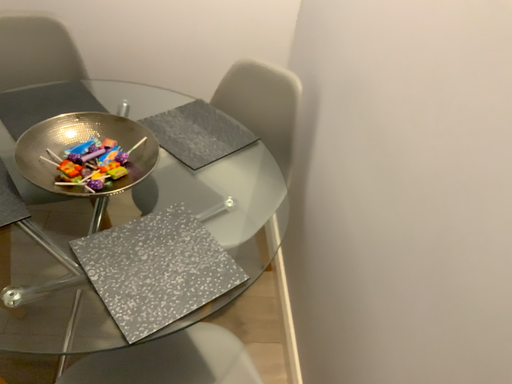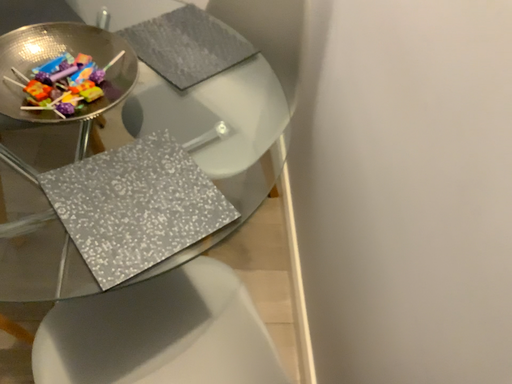
Question: How did the camera likely rotate when shooting the video?

Choices:
 (A) rotated downward
 (B) rotated upward

Answer: (A)